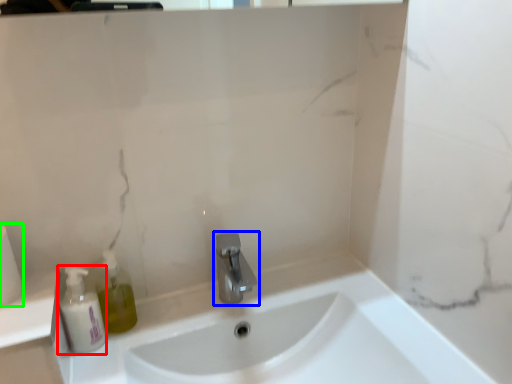
Question: Considering the real-world distances, which object is closest to mouthwash (highlighted by a red box)? tap (highlighted by a blue box) or toilet paper (highlighted by a green box).

Choices:
 (A) tap
 (B) toilet paper

Answer: (B)